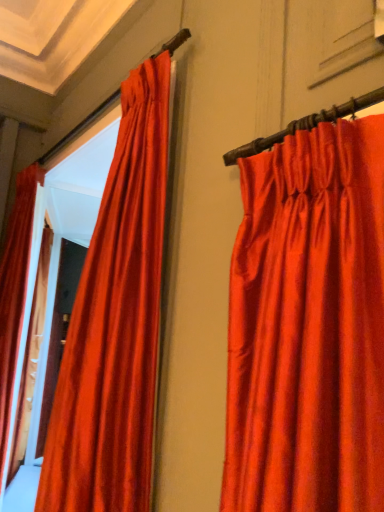
Question: Is satin red curtain at left, the first curtain positioned from the left, wider or thinner than satin red curtain at center, which ranks as the first curtain in front-to-back order?

Choices:
 (A) wide
 (B) thin

Answer: (B)

Question: Do you think satin red curtain at left, marked as the first curtain in a back-to-front arrangement, is within satin red curtain at center, positioned as the 2th curtain in back-to-front order, or outside of it?

Choices:
 (A) outside
 (B) inside

Answer: (A)

Question: Visually, is satin red curtain at left, marked as the first curtain in a back-to-front arrangement, positioned to the left or to the right of satin red curtain at center, which is the second curtain in left-to-right order?

Choices:
 (A) left
 (B) right

Answer: (A)

Question: From the image's perspective, is satin red curtain at center, positioned as the 2th curtain in back-to-front order, above or below satin red curtain at left, acting as the second curtain starting from the right?

Choices:
 (A) below
 (B) above

Answer: (B)

Question: In terms of width, does satin red curtain at center, which is the second curtain in left-to-right order, look wider or thinner when compared to satin red curtain at left, marked as the first curtain in a back-to-front arrangement?

Choices:
 (A) thin
 (B) wide

Answer: (B)

Question: From a real-world perspective, is satin red curtain at center, the first curtain viewed from the right, positioned above or below satin red curtain at left, marked as the first curtain in a back-to-front arrangement?

Choices:
 (A) above
 (B) below

Answer: (A)

Question: In the image, is satin red curtain at center, which is the second curtain in left-to-right order, positioned in front of or behind satin red curtain at left, acting as the second curtain starting from the right?

Choices:
 (A) front
 (B) behind

Answer: (A)